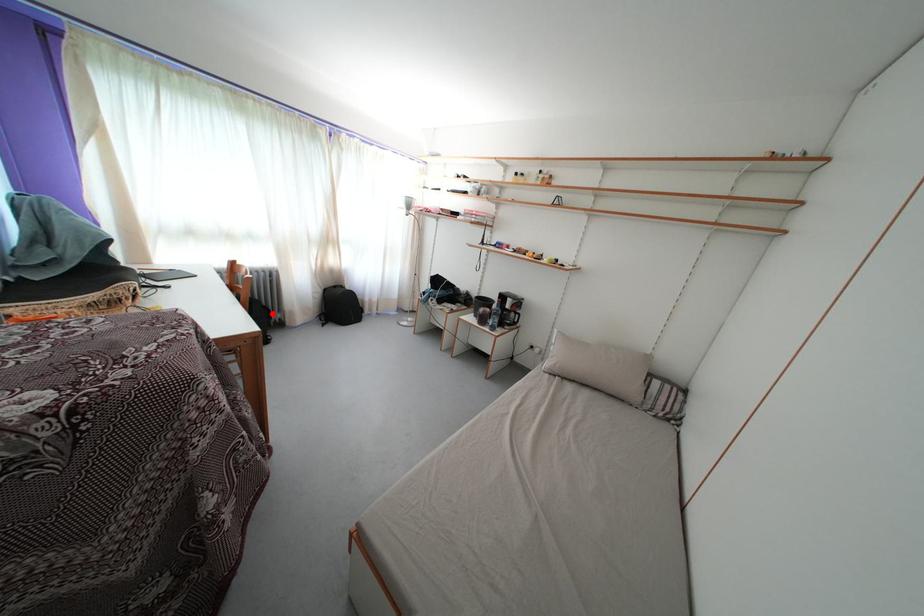
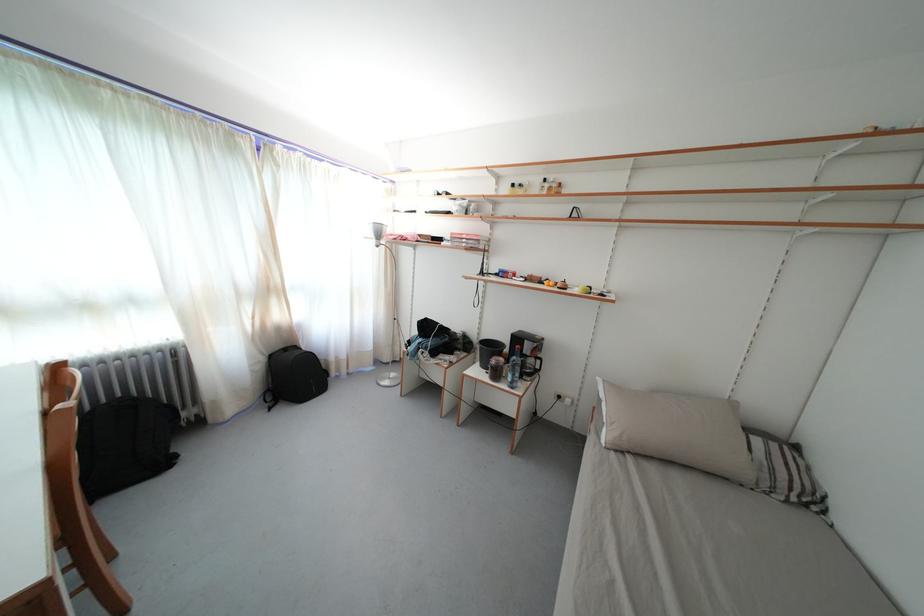
Question: I am providing you with two images of the same scene from different viewpoints. Image1 has a red point marked. In image2, the corresponding 3D location appears at what relative position? Reply with the corresponding letter.

Choices:
 (A) Closer
 (B) Farther

Answer: (B)